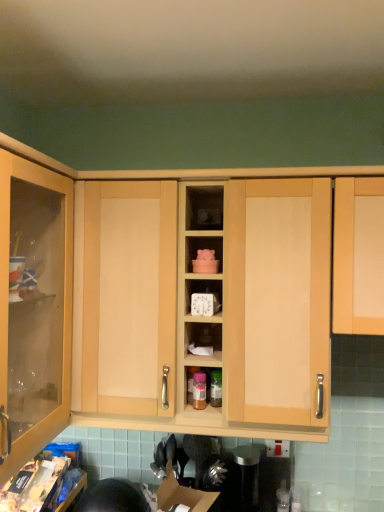
Question: Is satin silver canister at center at the right side of matte wood clock at center?

Choices:
 (A) no
 (B) yes

Answer: (B)

Question: Is satin silver canister at center to the left of matte wood clock at center from the viewer's perspective?

Choices:
 (A) yes
 (B) no

Answer: (B)

Question: Considering the relative sizes of satin silver canister at center and matte wood clock at center in the image provided, is satin silver canister at center thinner than matte wood clock at center?

Choices:
 (A) no
 (B) yes

Answer: (B)

Question: Is satin silver canister at center facing away from matte wood clock at center?

Choices:
 (A) yes
 (B) no

Answer: (B)

Question: From the image's perspective, is satin silver canister at center below matte wood clock at center?

Choices:
 (A) no
 (B) yes

Answer: (B)

Question: In terms of height, does light wood cabinet at right look taller or shorter compared to matte wood cabinet at center?

Choices:
 (A) short
 (B) tall

Answer: (A)

Question: Is light wood cabinet at right inside the boundaries of matte wood cabinet at center, or outside?

Choices:
 (A) inside
 (B) outside

Answer: (B)

Question: Is light wood cabinet at right in front of or behind matte wood cabinet at center in the image?

Choices:
 (A) front
 (B) behind

Answer: (A)

Question: Does point (350, 207) appear closer or farther from the camera than point (94, 396)?

Choices:
 (A) farther
 (B) closer

Answer: (B)

Question: Considering the positions of matte wood clock at center and matte wood cabinet at center in the image, is matte wood clock at center wider or thinner than matte wood cabinet at center?

Choices:
 (A) thin
 (B) wide

Answer: (A)

Question: Is matte wood clock at center bigger or smaller than matte wood cabinet at center?

Choices:
 (A) big
 (B) small

Answer: (B)

Question: From their relative heights in the image, would you say matte wood clock at center is taller or shorter than matte wood cabinet at center?

Choices:
 (A) tall
 (B) short

Answer: (B)

Question: In the image, is matte wood clock at center on the left side or the right side of matte wood cabinet at center?

Choices:
 (A) left
 (B) right

Answer: (B)

Question: Visually, is matte wood clock at center positioned to the left or to the right of satin silver canister at center?

Choices:
 (A) right
 (B) left

Answer: (B)

Question: Looking at their shapes, would you say matte wood clock at center is wider or thinner than satin silver canister at center?

Choices:
 (A) wide
 (B) thin

Answer: (A)